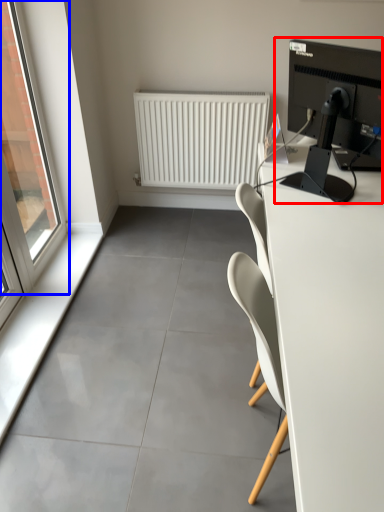
Question: Which object is closer to the camera taking this photo, desktop computer (highlighted by a red box) or window (highlighted by a blue box)?

Choices:
 (A) desktop computer
 (B) window

Answer: (A)